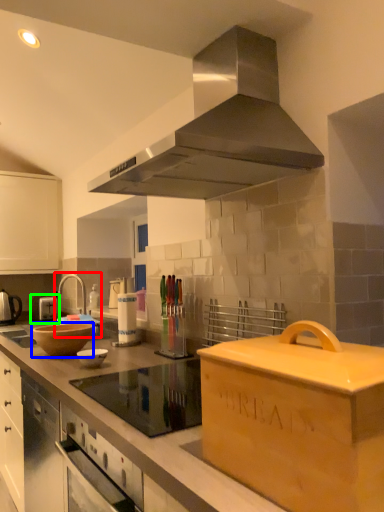
Question: Which is farther away from sink (highlighted by a red box)? mixing bowl (highlighted by a blue box) or appliance (highlighted by a green box)?

Choices:
 (A) mixing bowl
 (B) appliance

Answer: (A)